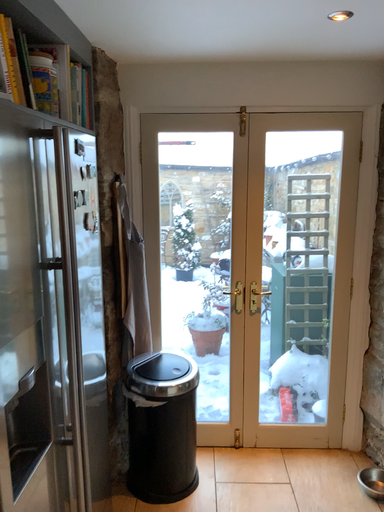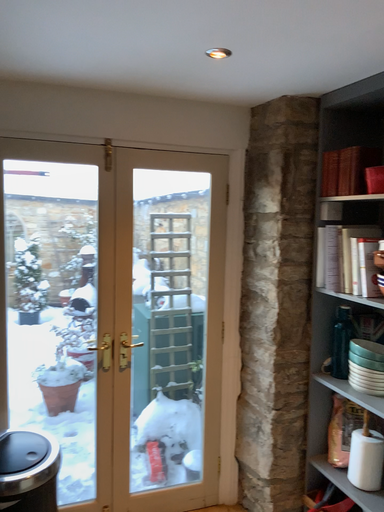
Question: How did the camera likely rotate when shooting the video?

Choices:
 (A) rotated left
 (B) rotated right

Answer: (B)